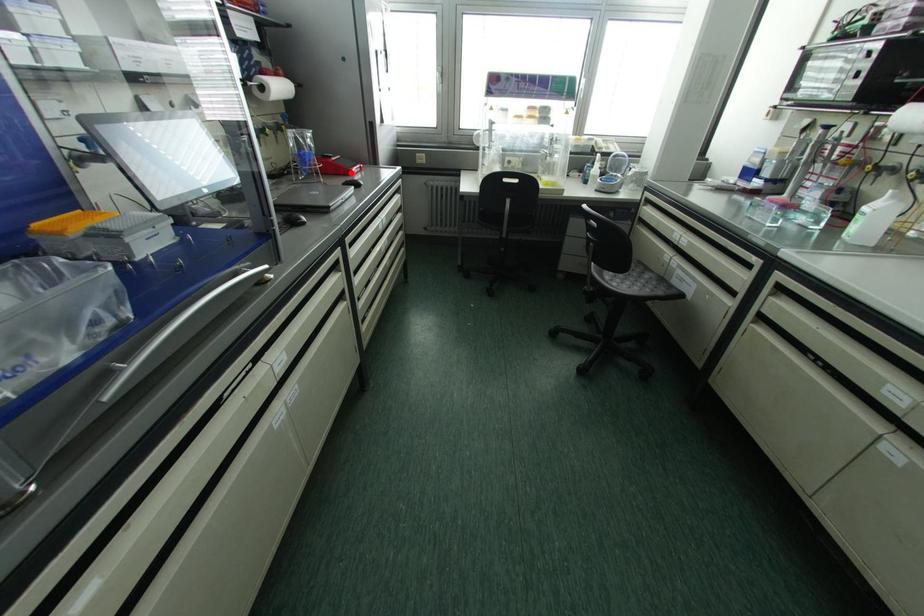
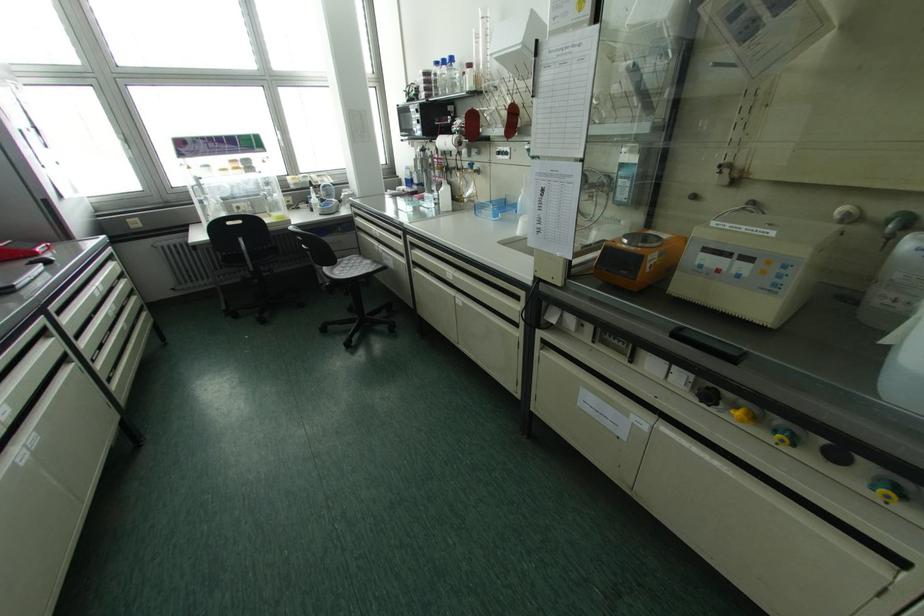
Question: I am providing you with two images of the same scene from different viewpoints. In image1, a red point is highlighted. Considering the same 3D point in image2, which of the following is correct?

Choices:
 (A) It is closer
 (B) It is farther

Answer: (B)